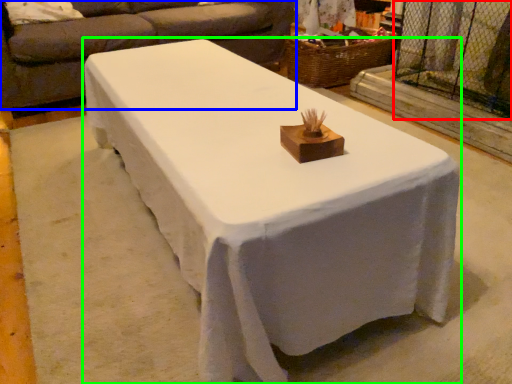
Question: Which is farther away from screen door (highlighted by a red box)? studio couch (highlighted by a blue box) or table (highlighted by a green box)?

Choices:
 (A) studio couch
 (B) table

Answer: (B)